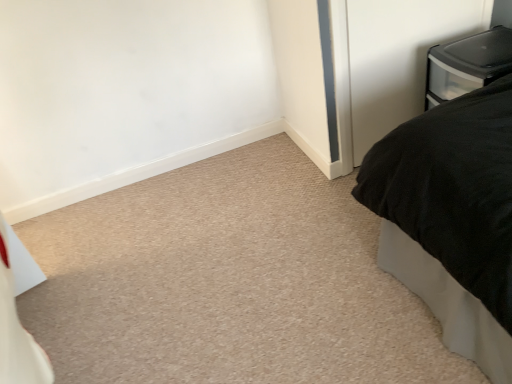
Question: Based on their sizes in the image, would you say clear plastic drawer at upper right is bigger or smaller than clear plastic storage container at upper right?

Choices:
 (A) small
 (B) big

Answer: (A)

Question: In terms of width, does clear plastic drawer at upper right look wider or thinner when compared to clear plastic storage container at upper right?

Choices:
 (A) thin
 (B) wide

Answer: (A)

Question: Which object is positioned closest to the black matte bed at right?

Choices:
 (A) clear plastic storage container at upper right
 (B) clear plastic drawer at upper right

Answer: (A)

Question: Considering the real-world distances, which object is closest to the clear plastic storage container at upper right?

Choices:
 (A) clear plastic drawer at upper right
 (B) black matte bed at right

Answer: (A)